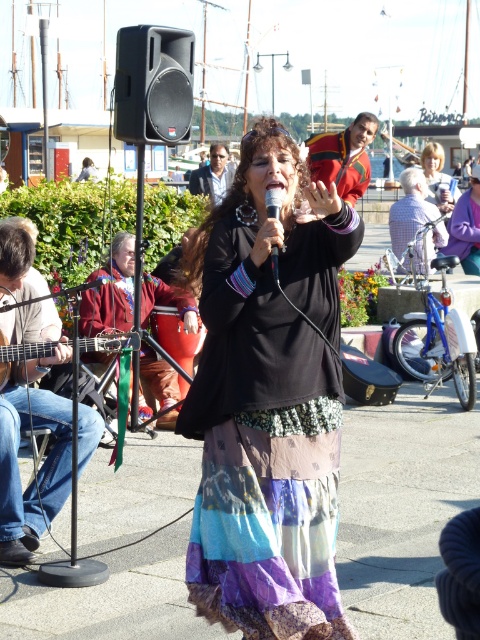
Who is taller, red leather drum at center or black matte microphone at center?

red leather drum at center is taller.

Is point (186, 324) farther from camera compared to point (266, 195)?

That is True.

You are a GUI agent. You are given a task and a screenshot of the screen. Output one action in this format:
    pyautogui.click(x=<x>, y=<y>)
    Task: Click on the red leather drum at center
    
    Given the screenshot: What is the action you would take?
    pyautogui.click(x=110, y=291)

Between point (168, 141) and point (208, 164), which one is positioned behind?

Point (208, 164)

Is black plastic speaker at upper left positioned in front of dark blue shirt at center?

Yes, it is.

Is point (151, 77) positioned before point (193, 182)?

Yes, it is.

Locate an element on the screen. The width and height of the screenshot is (480, 640). black plastic speaker at upper left is located at coordinates (154, 84).

Who is higher up, multicolored fabric skirt at center or wooden acoustic guitar at left?

wooden acoustic guitar at left is higher up.

Who is positioned more to the left, multicolored fabric skirt at center or wooden acoustic guitar at left?

From the viewer's perspective, wooden acoustic guitar at left appears more on the left side.

Find the location of a particular element. The height and width of the screenshot is (640, 480). multicolored fabric skirt at center is located at coordinates (268, 401).